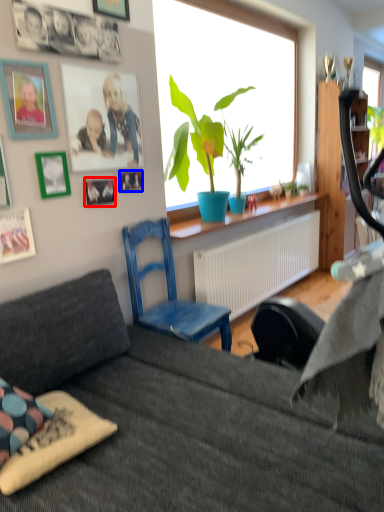
Question: Which point is further to the camera, picture frame (highlighted by a red box) or picture frame (highlighted by a blue box)?

Choices:
 (A) picture frame
 (B) picture frame

Answer: (B)